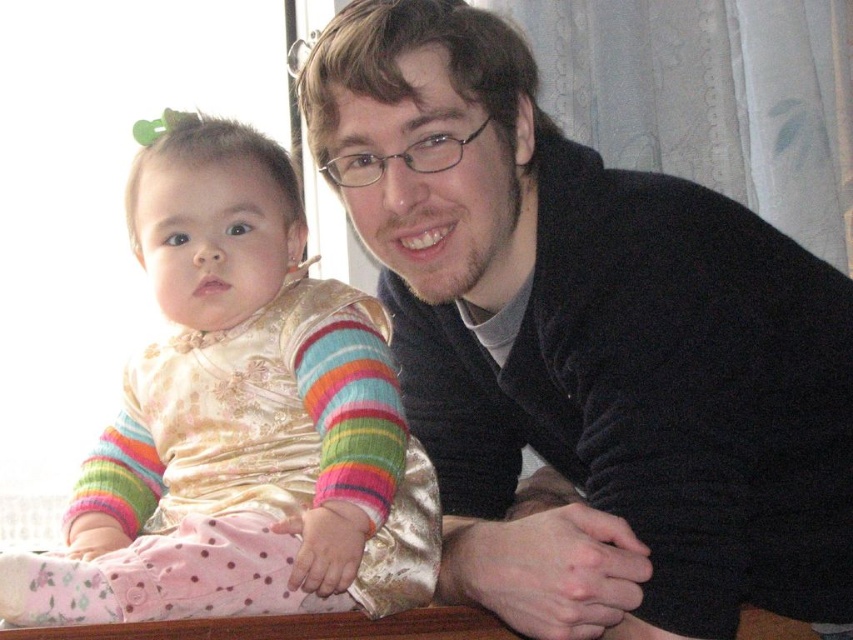
You are a photographer setting up a shoot. You have to position a light source to the side of the black velvet sweater at upper right and the silky gold dress at left. Considering their heights, which object should the light be placed closer to?

The light should be placed closer to the silky gold dress at left because the black velvet sweater at upper right is much taller, so the light needs to be positioned closer to the shorter object to ensure proper illumination.

You are an interior designer planning to place a new painting on the wall in the scene. The painting must be positioned exactly at the coordinates given for the black velvet sweater at upper right. What are the coordinates where you should place the painting?

You should place the painting at coordinates point (587, 346), as that is the exact location of the black velvet sweater at upper right.